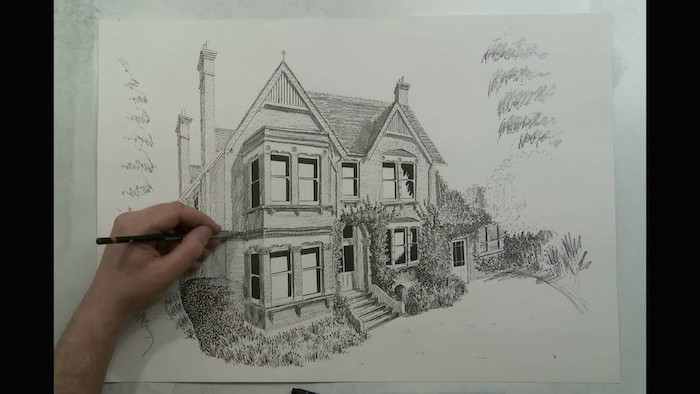
Locate an element on the screen. The width and height of the screenshot is (700, 394). door is located at coordinates (353, 256), (463, 260).